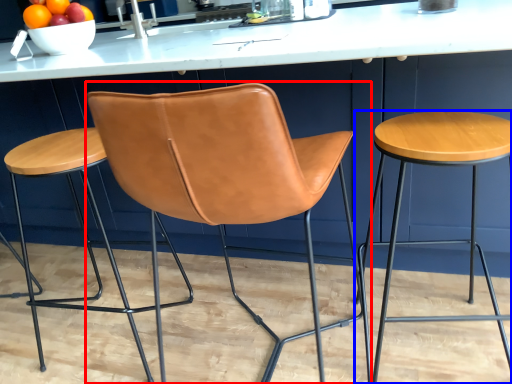
Question: Which of the following is the farthest to the observer, chair (highlighted by a red box) or stool (highlighted by a blue box)?

Choices:
 (A) chair
 (B) stool

Answer: (B)